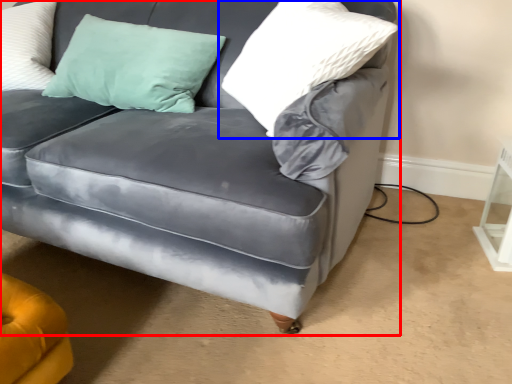
Question: Which point is closer to the camera, studio couch (highlighted by a red box) or pillow (highlighted by a blue box)?

Choices:
 (A) studio couch
 (B) pillow

Answer: (A)